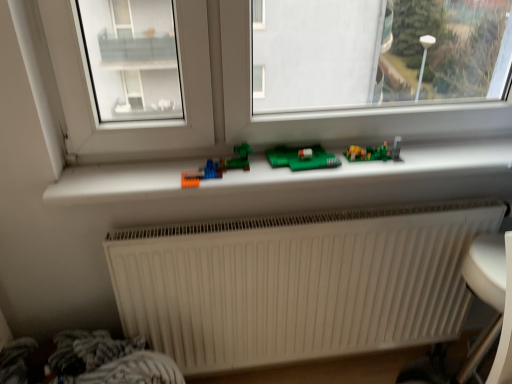
This screenshot has width=512, height=384. What are the coordinates of `vacant space situated above white plastic window sill at center (from a real-world perspective)` in the screenshot? It's located at [x=308, y=167].